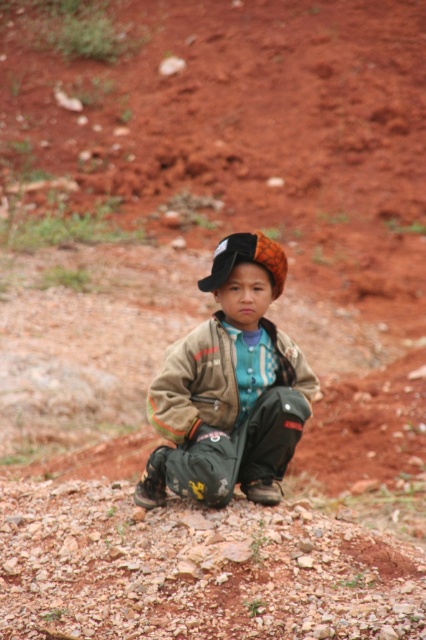
Question: Which point appears closest to the camera in this image?

Choices:
 (A) pos(276,364)
 (B) pos(259,237)
 (C) pos(219,422)

Answer: (C)

Question: Is camouflage pants at center thinner than brown textured jacket at center?

Choices:
 (A) no
 (B) yes

Answer: (A)

Question: Which point appears closest to the camera in this image?

Choices:
 (A) (278, 253)
 (B) (273, 362)

Answer: (A)

Question: Can you confirm if camouflage pants at center is positioned to the left of brown textured jacket at center?

Choices:
 (A) no
 (B) yes

Answer: (A)

Question: Which point is farther from the camera taking this photo?

Choices:
 (A) (229, 266)
 (B) (195, 392)
 (C) (227, 403)

Answer: (B)

Question: Does camouflage pants at center appear on the left side of brown textured jacket at center?

Choices:
 (A) no
 (B) yes

Answer: (A)